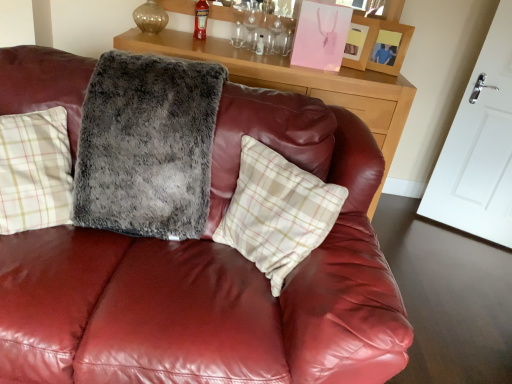
Identify the location of free spot to the right of red glass bottle at upper center. The width and height of the screenshot is (512, 384). (225, 46).